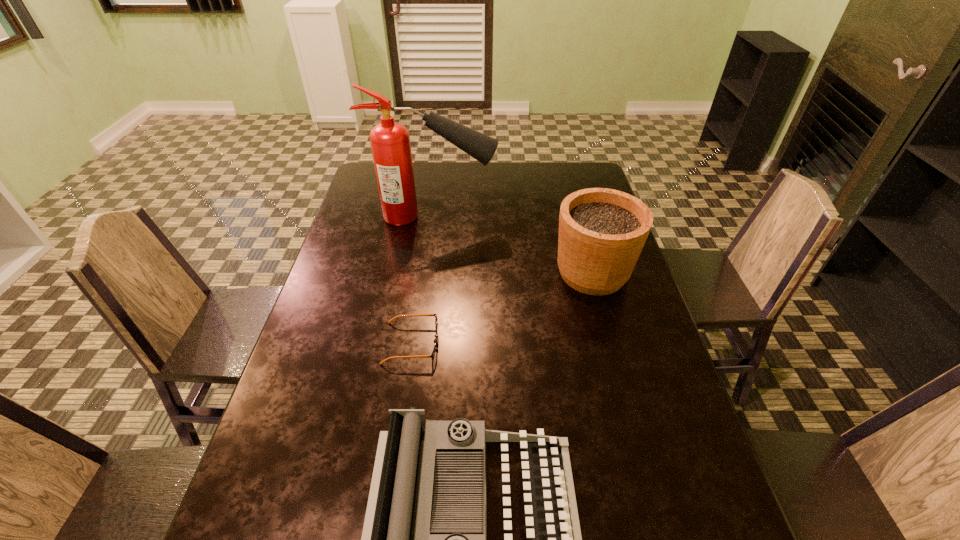
Locate an element on the screen. Image resolution: width=960 pixels, height=540 pixels. vacant area that satisfies the following two spatial constraints: 1. on the back side of the third shortest object; 2. at the nozzle of the fire extinguisher is located at coordinates click(x=577, y=217).

Locate an element on the screen. This screenshot has height=540, width=960. blank space that satisfies the following two spatial constraints: 1. at the nozzle of the farthest object; 2. on the right side of the second tallest object is located at coordinates (426, 273).

Find the location of a particular element. The image size is (960, 540). vacant position in the image that satisfies the following two spatial constraints: 1. at the nozzle of the third nearest object; 2. on the right side of the tallest object is located at coordinates (426, 273).